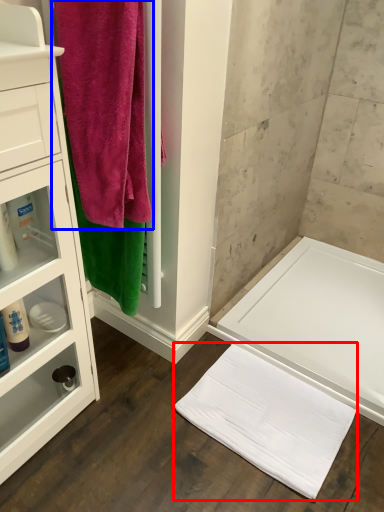
Question: Which object is further to the camera taking this photo, bath towel (highlighted by a red box) or towel (highlighted by a blue box)?

Choices:
 (A) bath towel
 (B) towel

Answer: (A)